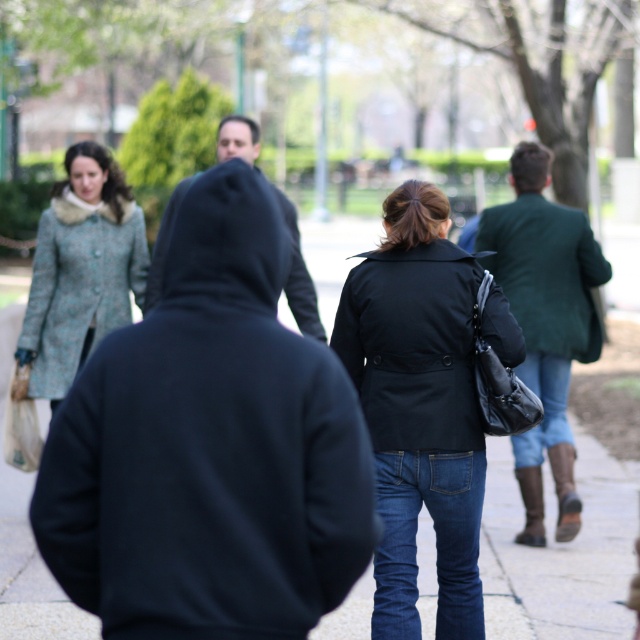
In the scene shown: Which of these two, matte black coat at center or teal textured coat at left, stands shorter?

teal textured coat at left

The height and width of the screenshot is (640, 640). What do you see at coordinates (419, 406) in the screenshot?
I see `matte black coat at center` at bounding box center [419, 406].

Where is `matte black coat at center`? This screenshot has width=640, height=640. matte black coat at center is located at coordinates (419, 406).